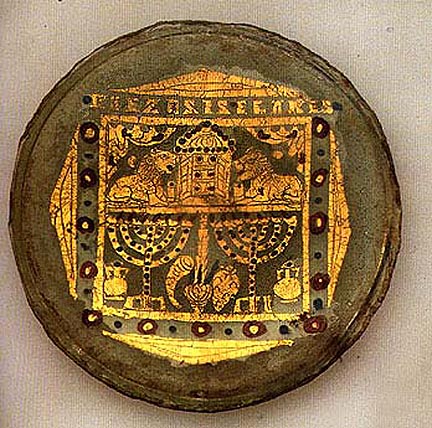
Locate an element on the screen. vase is located at coordinates (119, 282), (289, 284).